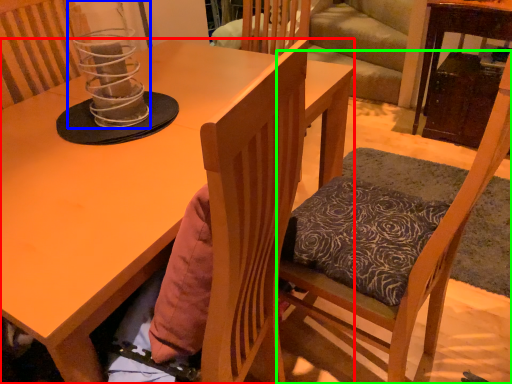
Question: Estimate the real-world distances between objects in this image. Which object is farther from desk (highlighted by a red box), candle holder (highlighted by a blue box) or chair (highlighted by a green box)?

Choices:
 (A) candle holder
 (B) chair

Answer: (B)